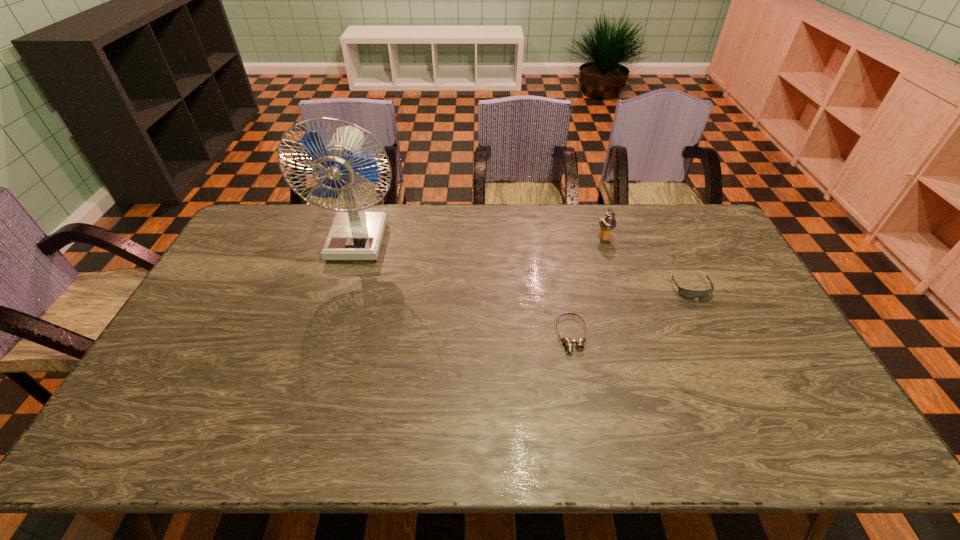
The height and width of the screenshot is (540, 960). What are the coordinates of `object that is the closest to the third shortest object` in the screenshot? It's located at (686, 293).

Point out which object is positioned as the third nearest to the taller goggles. Please provide its 2D coordinates. Your answer should be formatted as a tuple, i.e. [(x, y)], where the tuple contains the x and y coordinates of a point satisfying the conditions above.

[(355, 235)]